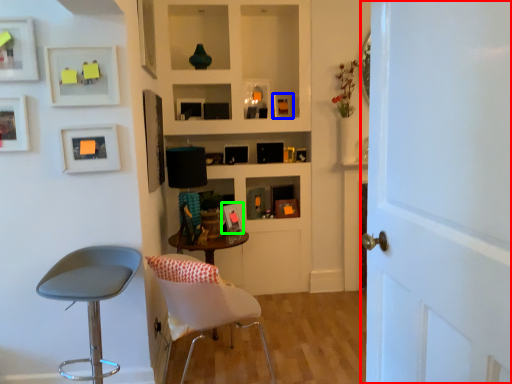
Question: Which object is positioned farthest from door (highlighted by a red box)? Select from picture frame (highlighted by a blue box) and picture frame (highlighted by a green box).

Choices:
 (A) picture frame
 (B) picture frame

Answer: (A)